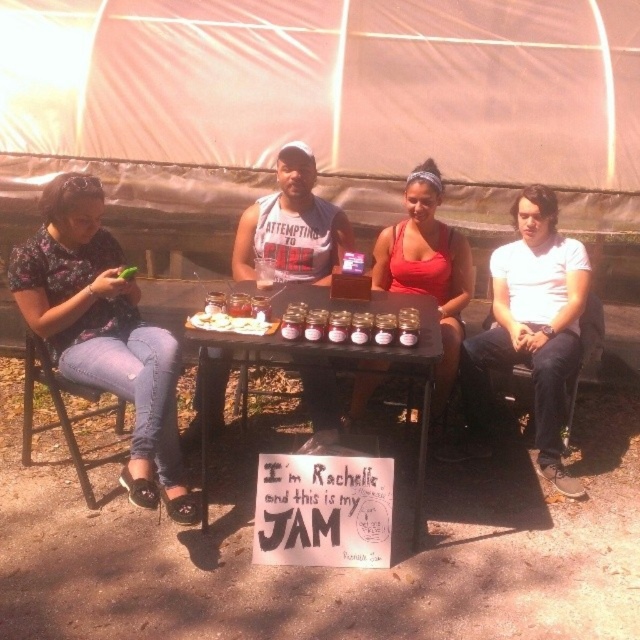
You are a customer at a market event and want to approach the wooden table at center to buy jam. However, there is a white cotton shirt at right blocking your path. Can you walk directly to the table without moving around the shirt?

The wooden table at center is behind the white cotton shirt at right, so you would need to move around the white cotton shirt at right to reach the wooden table at center directly.

You are standing at the center of the image facing the scene. Which direction should you turn to see the floral fabric shirt at left?

Since the floral fabric shirt at left is positioned at point 0.520 on the x axis and 0.163 on the y axis, you should turn to your left to see it.

You are a customer at a market stall and see the floral fabric shirt at left and the white creamy cheese at table center. Which item is closer to the ground?

The floral fabric shirt at left is closer to the ground because it is positioned under the white creamy cheese at table center.